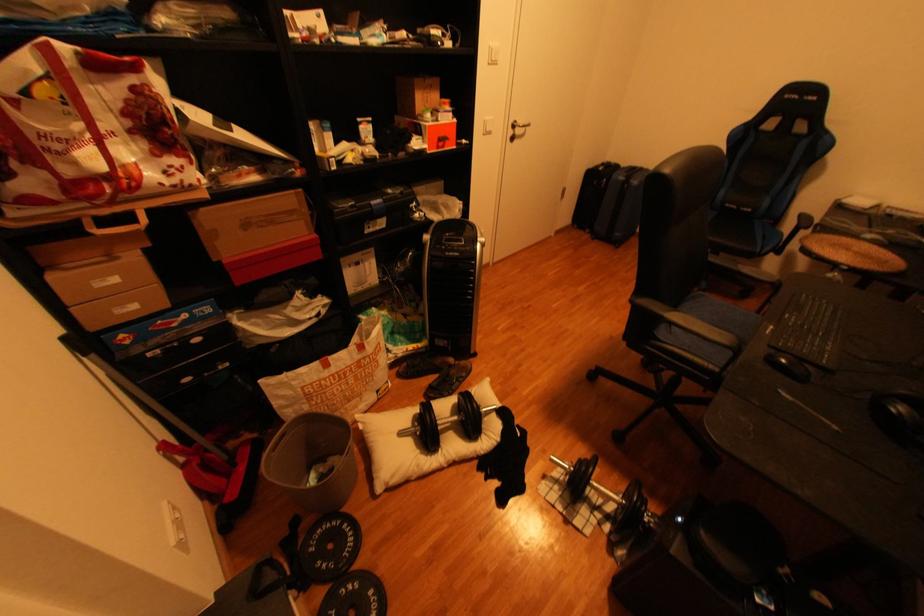
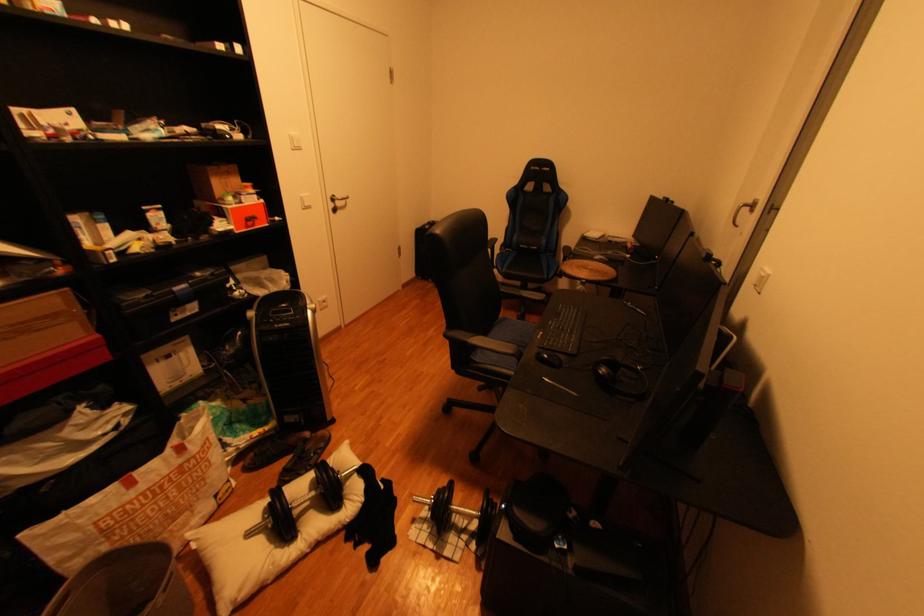
The point at (672, 317) is marked in the first image. Where is the corresponding point in the second image?

(477, 344)